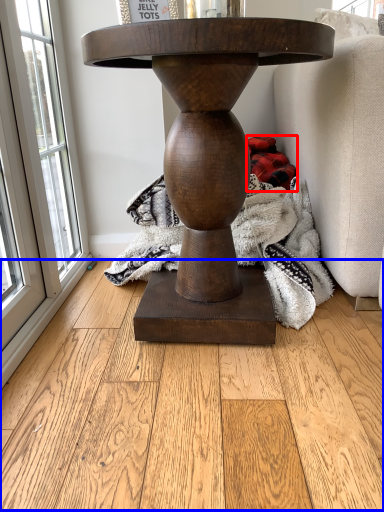
Question: Which point is closer to the camera, material (highlighted by a red box) or hardwood (highlighted by a blue box)?

Choices:
 (A) material
 (B) hardwood

Answer: (B)